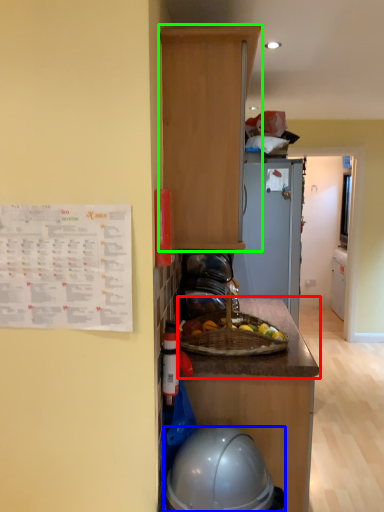
Question: Which is nearer to the countertop (highlighted by a red box)? helmet (highlighted by a blue box) or cabinetry (highlighted by a green box).

Choices:
 (A) helmet
 (B) cabinetry

Answer: (A)